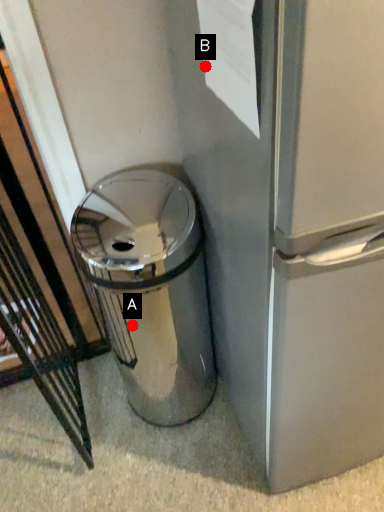
Question: Two points are circled on the image, labeled by A and B beside each circle. Which point is closer to the camera taking this photo?

Choices:
 (A) A is closer
 (B) B is closer

Answer: (B)